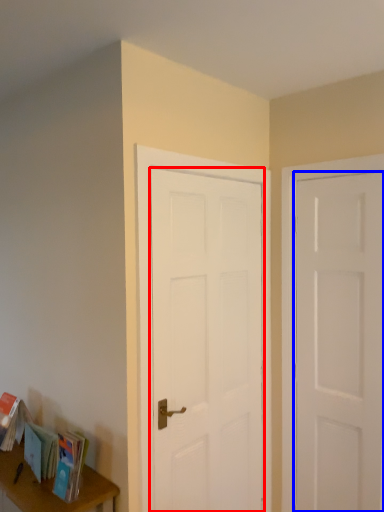
Question: Which object appears farthest to the camera in this image, door (highlighted by a red box) or door (highlighted by a blue box)?

Choices:
 (A) door
 (B) door

Answer: (B)